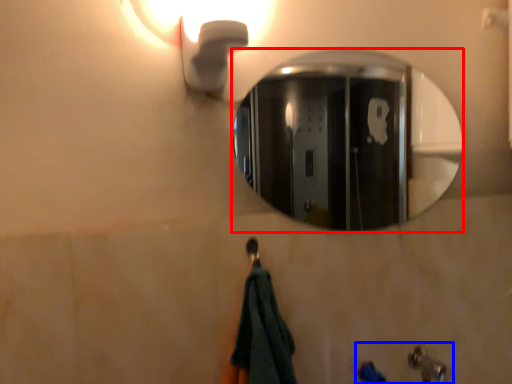
Question: Which object appears farthest to the camera in this image, mirror (highlighted by a red box) or sink (highlighted by a blue box)?

Choices:
 (A) mirror
 (B) sink

Answer: (A)